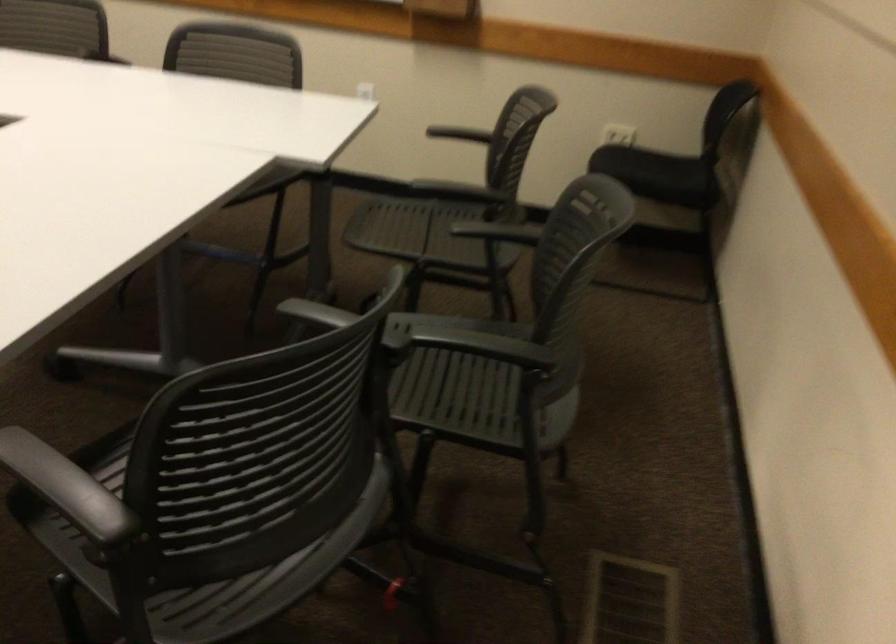
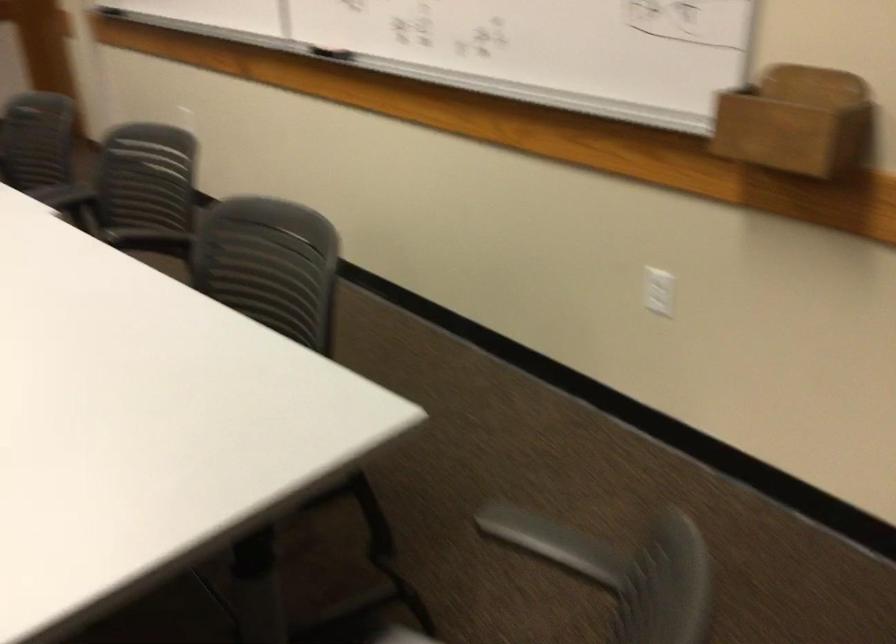
Find the pixel in the second image that matches pixel 213 80 in the first image.

(270, 289)